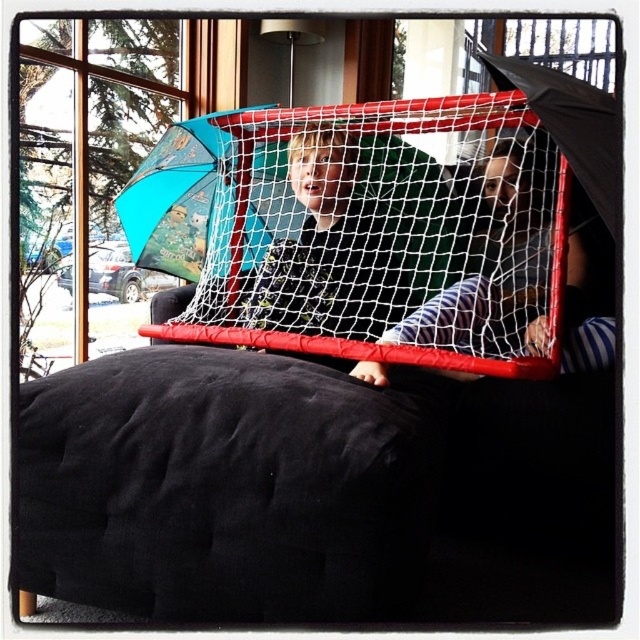
Is striped fabric shirt at center closer to camera compared to blue fabric umbrella at upper left?

Yes, it is.

In the scene shown: Does striped fabric shirt at center lie behind blue fabric umbrella at upper left?

That is False.

This screenshot has height=640, width=640. Describe the element at coordinates (497, 269) in the screenshot. I see `striped fabric shirt at center` at that location.

I want to click on striped fabric shirt at center, so click(497, 269).

The width and height of the screenshot is (640, 640). What do you see at coordinates (497, 269) in the screenshot?
I see `striped fabric shirt at center` at bounding box center [497, 269].

Does striped fabric shirt at center appear over matte black shirt at center?

Incorrect, striped fabric shirt at center is not positioned above matte black shirt at center.

Is point (497, 150) positioned before point (342, 307)?

No, it is behind (342, 307).

Identify the location of striped fabric shirt at center. (497, 269).

Can you confirm if blue fabric umbrella at upper left is positioned above matte black shirt at center?

Yes.

Is blue fabric umbrella at upper left taller than matte black shirt at center?

In fact, blue fabric umbrella at upper left may be shorter than matte black shirt at center.

Between point (268, 180) and point (282, 307), which one is positioned in front?

Positioned in front is point (282, 307).

Locate an element on the screen. blue fabric umbrella at upper left is located at coordinates (182, 198).